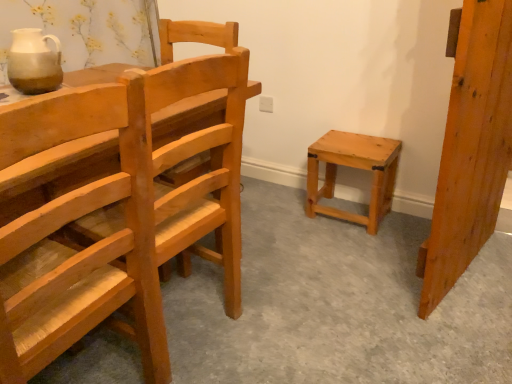
Question: From the image's perspective, would you say natural wood stool at center-right is shown under natural wood chair at left?

Choices:
 (A) no
 (B) yes

Answer: (A)

Question: From a real-world perspective, is natural wood stool at center-right physically below natural wood chair at left?

Choices:
 (A) yes
 (B) no

Answer: (A)

Question: Considering the relative sizes of natural wood stool at center-right and natural wood chair at left in the image provided, is natural wood stool at center-right shorter than natural wood chair at left?

Choices:
 (A) yes
 (B) no

Answer: (A)

Question: Is natural wood stool at center-right at the left side of natural wood chair at left?

Choices:
 (A) yes
 (B) no

Answer: (B)

Question: Does natural wood stool at center-right have a greater width compared to natural wood chair at left?

Choices:
 (A) no
 (B) yes

Answer: (A)

Question: Is natural wood stool at center-right oriented towards natural wood chair at left?

Choices:
 (A) yes
 (B) no

Answer: (A)

Question: Is natural wood door at right far from natural wood chair at left?

Choices:
 (A) no
 (B) yes

Answer: (B)

Question: Is natural wood chair at left at the back of natural wood door at right?

Choices:
 (A) no
 (B) yes

Answer: (A)

Question: Can you confirm if natural wood door at right is smaller than natural wood chair at left?

Choices:
 (A) no
 (B) yes

Answer: (B)

Question: From a real-world perspective, is natural wood door at right located higher than natural wood chair at left?

Choices:
 (A) yes
 (B) no

Answer: (A)

Question: Is natural wood door at right positioned behind natural wood chair at left?

Choices:
 (A) yes
 (B) no

Answer: (A)

Question: From the image's perspective, would you say natural wood door at right is shown under natural wood chair at left?

Choices:
 (A) yes
 (B) no

Answer: (B)

Question: From a real-world perspective, is matte ceramic jug at upper left physically above natural wood door at right?

Choices:
 (A) yes
 (B) no

Answer: (A)